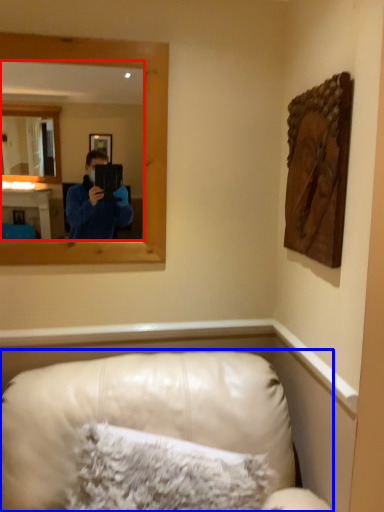
Question: Which of the following is the farthest to the observer, mirror (highlighted by a red box) or furniture (highlighted by a blue box)?

Choices:
 (A) mirror
 (B) furniture

Answer: (A)